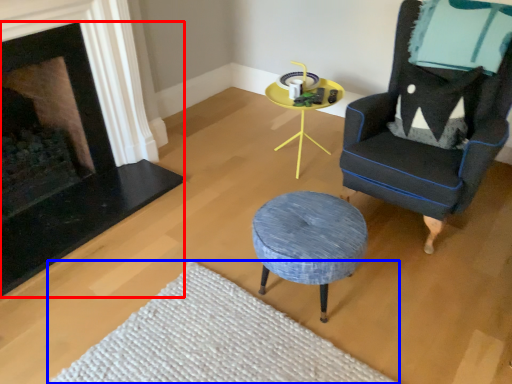
Question: Which object appears closest to the camera in this image, fireplace (highlighted by a red box) or plain (highlighted by a blue box)?

Choices:
 (A) fireplace
 (B) plain

Answer: (B)